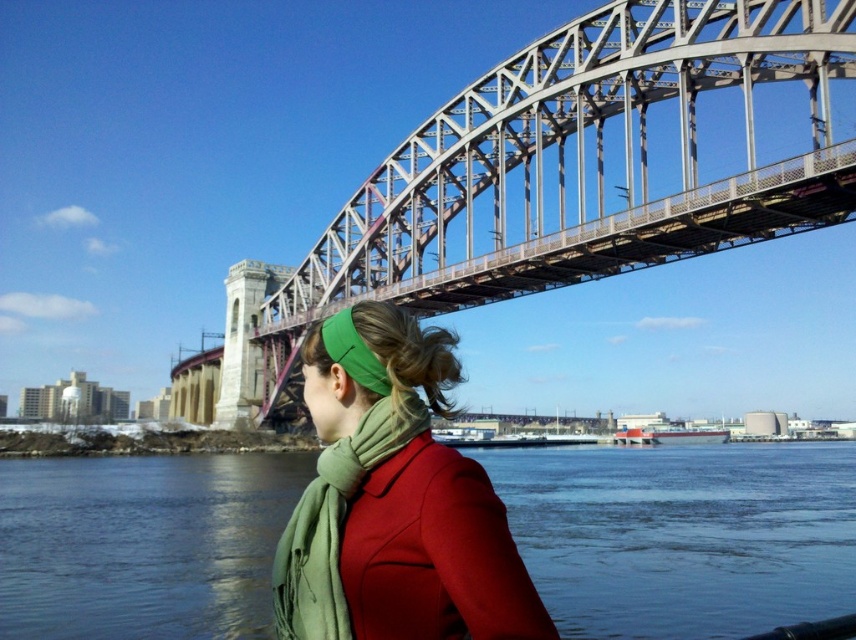
Question: Is metallic steel bridge at upper center smaller than green matte headband at upper center?

Choices:
 (A) yes
 (B) no

Answer: (B)

Question: Can you confirm if metallic steel bridge at upper center is wider than green matte headband at upper center?

Choices:
 (A) yes
 (B) no

Answer: (A)

Question: Can you confirm if blue water at center is bigger than green matte headband at upper center?

Choices:
 (A) yes
 (B) no

Answer: (A)

Question: Among these objects, which one is farthest from the camera?

Choices:
 (A) metallic steel bridge at upper center
 (B) blue water at center
 (C) green matte headband at upper center

Answer: (B)

Question: Which of these objects is positioned closest to the green soft scarf at center?

Choices:
 (A) green matte headband at upper center
 (B) metallic steel bridge at upper center

Answer: (A)

Question: Estimate the real-world distances between objects in this image. Which object is farther from the green matte headband at upper center?

Choices:
 (A) metallic steel bridge at upper center
 (B) blue water at center

Answer: (A)